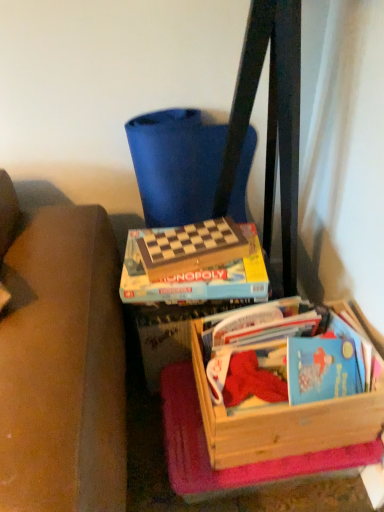
Question: Are wooden crate at lower right and blue fabric folding chair at upper center making contact?

Choices:
 (A) no
 (B) yes

Answer: (A)

Question: Would you consider wooden crate at lower right to be distant from blue fabric folding chair at upper center?

Choices:
 (A) yes
 (B) no

Answer: (B)

Question: Could you tell me if wooden crate at lower right is facing blue fabric folding chair at upper center?

Choices:
 (A) no
 (B) yes

Answer: (A)

Question: From a real-world perspective, is wooden crate at lower right positioned over blue fabric folding chair at upper center based on gravity?

Choices:
 (A) no
 (B) yes

Answer: (A)

Question: From a real-world perspective, is wooden crate at lower right positioned under blue fabric folding chair at upper center based on gravity?

Choices:
 (A) no
 (B) yes

Answer: (B)

Question: Is wooden crate at lower right turned away from blue fabric folding chair at upper center?

Choices:
 (A) no
 (B) yes

Answer: (A)

Question: Is blue fabric folding chair at upper center not near wooden paperback book at center?

Choices:
 (A) no
 (B) yes

Answer: (A)

Question: From the image's perspective, is blue fabric folding chair at upper center located beneath wooden paperback book at center?

Choices:
 (A) yes
 (B) no

Answer: (B)

Question: Is wooden paperback book at center a part of blue fabric folding chair at upper center?

Choices:
 (A) yes
 (B) no

Answer: (B)

Question: Can you confirm if blue fabric folding chair at upper center is thinner than wooden paperback book at center?

Choices:
 (A) yes
 (B) no

Answer: (B)

Question: Does blue fabric folding chair at upper center have a larger size compared to wooden paperback book at center?

Choices:
 (A) yes
 (B) no

Answer: (A)

Question: Is blue fabric folding chair at upper center closer to the viewer compared to wooden paperback book at center?

Choices:
 (A) yes
 (B) no

Answer: (B)

Question: Are wooden paperback book at center and wooden crate at lower right far apart?

Choices:
 (A) yes
 (B) no

Answer: (B)